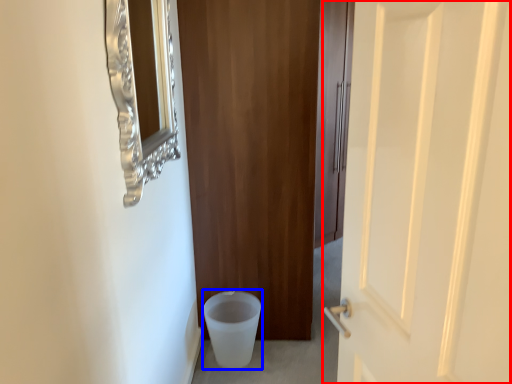
Question: Which object appears closest to the camera in this image, door (highlighted by a red box) or potty (highlighted by a blue box)?

Choices:
 (A) door
 (B) potty

Answer: (A)